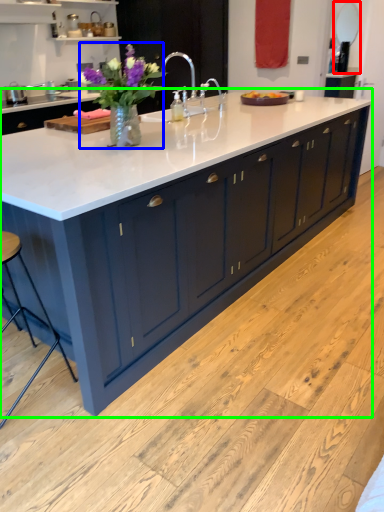
Question: Based on their relative distances, which object is nearer to mirror (highlighted by a red box)? Choose from flower (highlighted by a blue box) and countertop (highlighted by a green box).

Choices:
 (A) flower
 (B) countertop

Answer: (B)